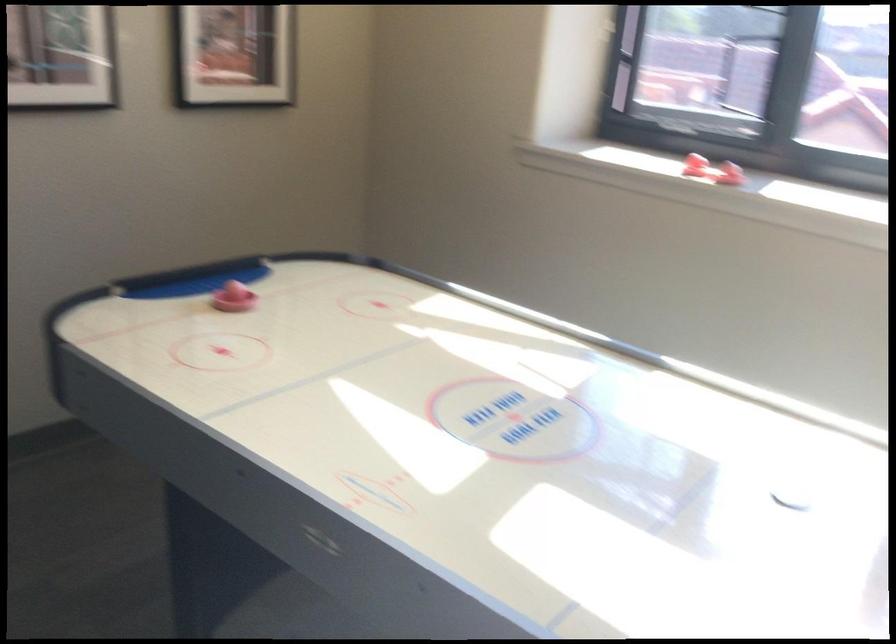
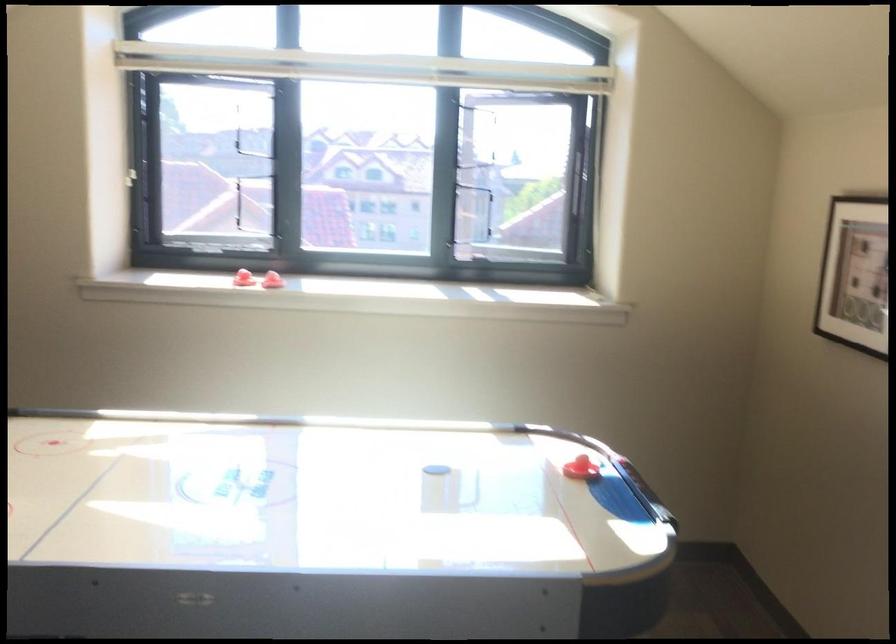
The point at (817,497) is marked in the first image. Where is the corresponding point in the second image?

(442, 467)